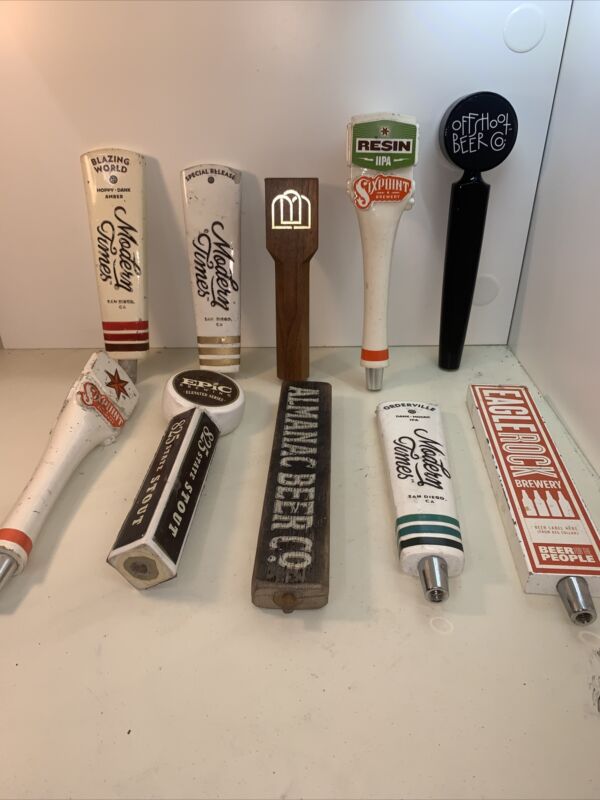
Where is `objects related to bars and beers in the display cabinet`? This screenshot has width=600, height=800. objects related to bars and beers in the display cabinet is located at coordinates (532, 466), (414, 452), (293, 462), (186, 452), (64, 438), (121, 313), (210, 305), (295, 236), (381, 193), (472, 154).